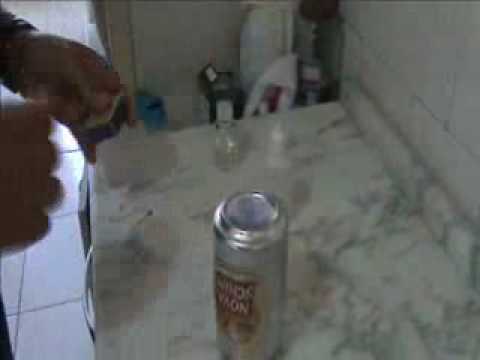
Locate an element on the screen. bathroom tiles is located at coordinates (65, 284), (62, 326).